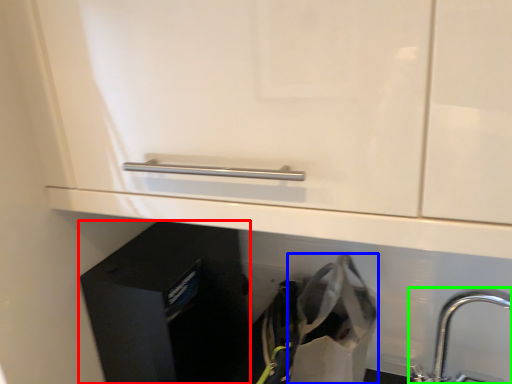
Question: Estimate the real-world distances between objects in this image. Which object is farther from file cabinet (highlighted by a red box), shopping bag (highlighted by a blue box) or tap (highlighted by a green box)?

Choices:
 (A) shopping bag
 (B) tap

Answer: (B)